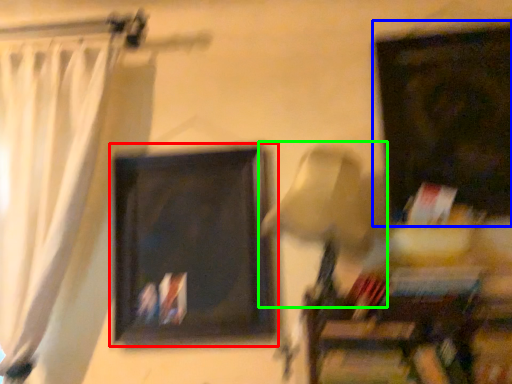
Question: Considering the real-world distances, which object is closest to picture frame (highlighted by a red box)? picture frame (highlighted by a blue box) or table lamp (highlighted by a green box).

Choices:
 (A) picture frame
 (B) table lamp

Answer: (B)